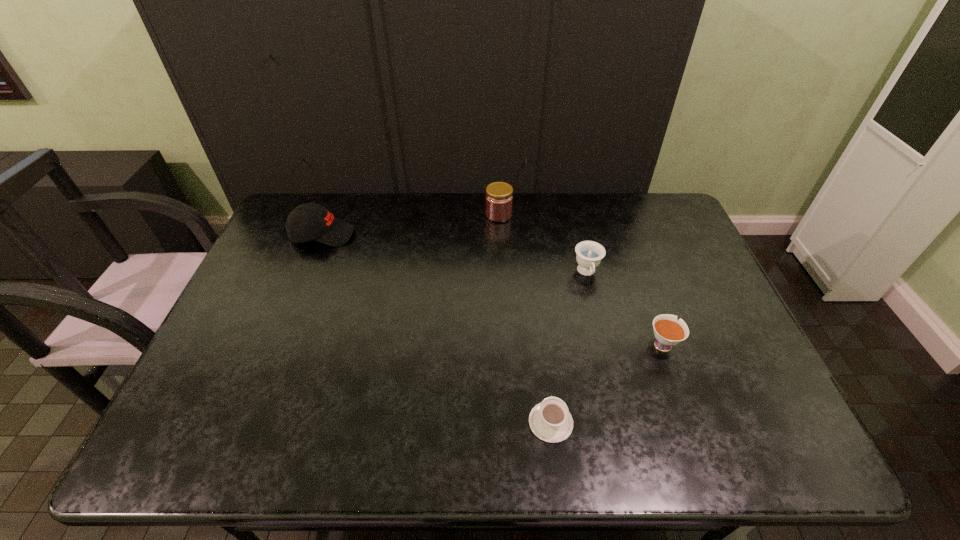
Where is `vacant space located 0.310m on the side of the third farthest object with the handle`? vacant space located 0.310m on the side of the third farthest object with the handle is located at coordinates (612, 378).

The width and height of the screenshot is (960, 540). Identify the location of free space located 0.120m on the side of the second farthest teacup with the handle. (645, 295).

Find the location of `vacant space located on the side of the second farthest teacup with the handle`. vacant space located on the side of the second farthest teacup with the handle is located at coordinates (626, 244).

The height and width of the screenshot is (540, 960). In order to click on free spot located 0.190m on the side of the second farthest teacup with the handle in this screenshot , I will do [x=638, y=279].

This screenshot has height=540, width=960. Find the location of `vacant space situated on the handle side of the nearest teacup`. vacant space situated on the handle side of the nearest teacup is located at coordinates (540, 331).

Find the location of a particular element. free spot located on the handle side of the nearest teacup is located at coordinates (540, 325).

The image size is (960, 540). Identify the location of vacant area situated on the handle side of the nearest teacup. (542, 356).

Where is `baseball cap situated at the far edge`? This screenshot has width=960, height=540. baseball cap situated at the far edge is located at coordinates (311, 221).

What are the coordinates of `jam at the far edge` in the screenshot? It's located at (499, 198).

Where is `object located at the near edge`? The height and width of the screenshot is (540, 960). object located at the near edge is located at coordinates (550, 420).